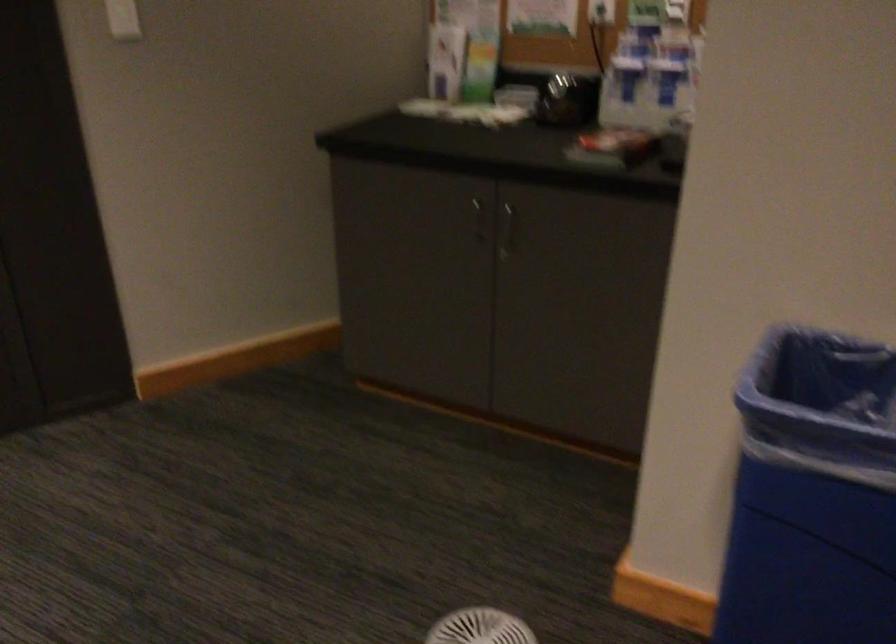
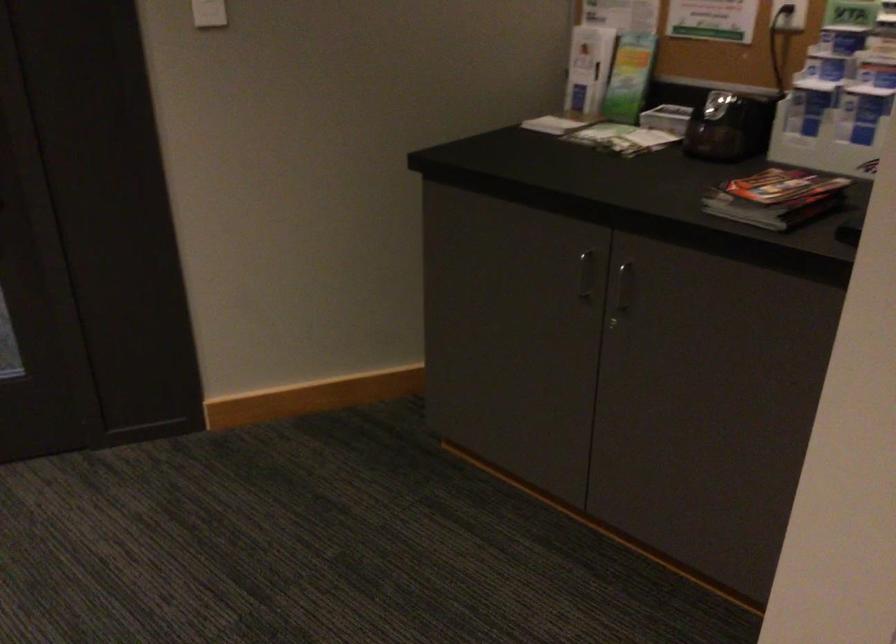
The point at (507,111) is marked in the first image. Where is the corresponding point in the second image?

(647, 140)